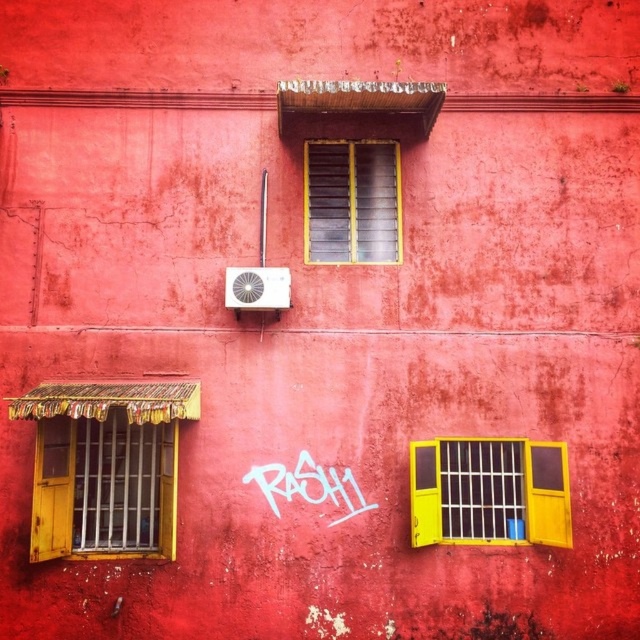
Question: Does yellow matte window at center appear on the right side of white graffiti at center?

Choices:
 (A) yes
 (B) no

Answer: (A)

Question: Observing the image, what is the correct spatial positioning of wooden window at left in reference to yellow matte window at lower right?

Choices:
 (A) below
 (B) above

Answer: (B)

Question: Is yellow matte window at center thinner than white graffiti at center?

Choices:
 (A) yes
 (B) no

Answer: (A)

Question: Which point is farther to the camera?

Choices:
 (A) yellow matte window at lower right
 (B) white graffiti at center
 (C) yellow matte window at center

Answer: (C)

Question: Which object appears farthest from the camera in this image?

Choices:
 (A) yellow matte window at center
 (B) yellow matte window at lower right
 (C) white graffiti at center
 (D) wooden window at left

Answer: (A)

Question: Which object is closer to the camera taking this photo?

Choices:
 (A) yellow matte window at center
 (B) yellow matte window at lower right
 (C) white graffiti at center

Answer: (B)